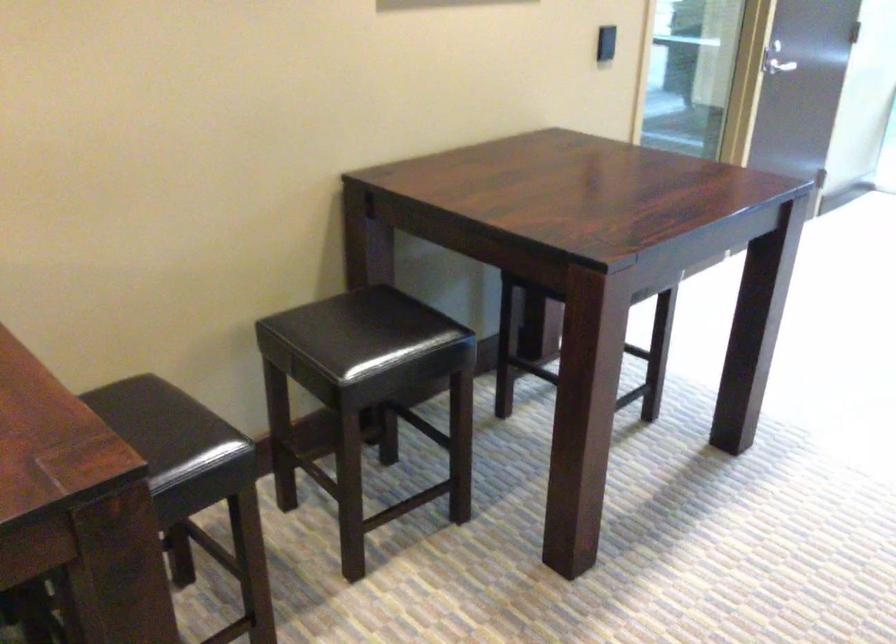
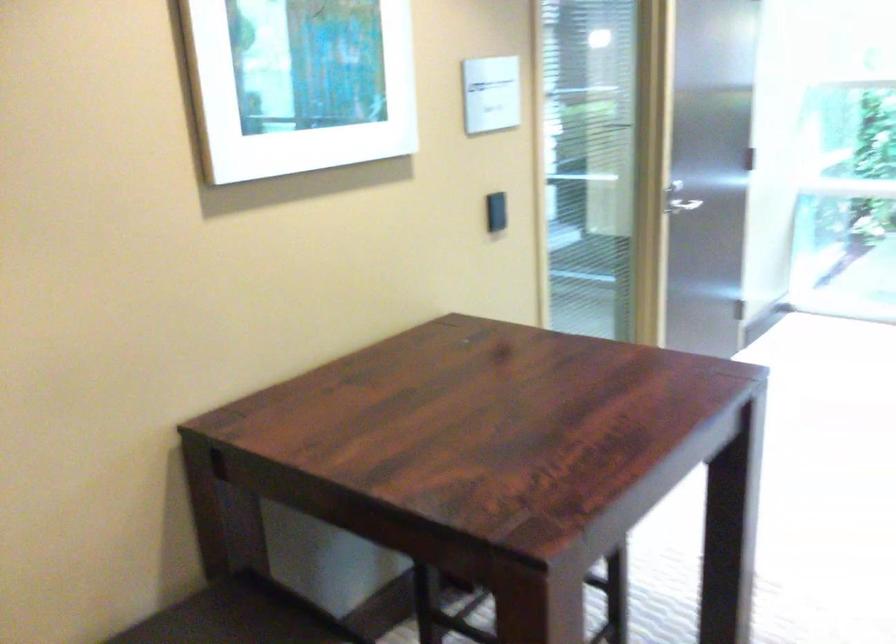
Question: The images are taken continuously from a first-person perspective. In which direction is your viewpoint rotating?

Choices:
 (A) Left
 (B) Right
 (C) Up
 (D) Down

Answer: (C)